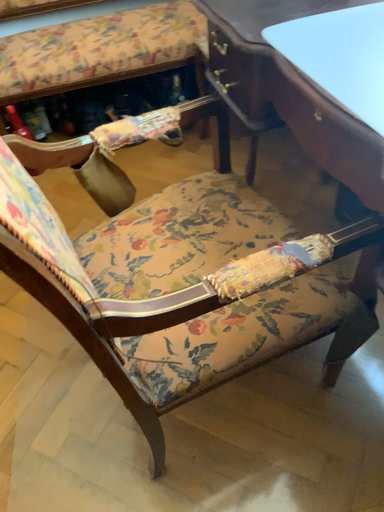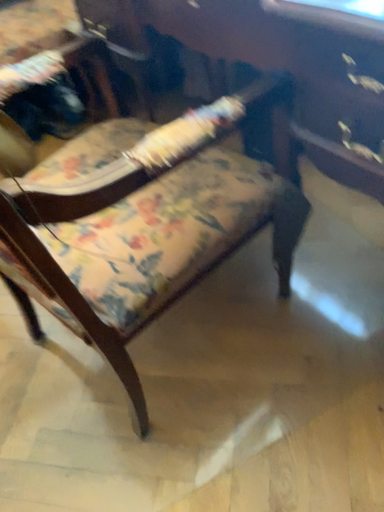
Question: How did the camera likely rotate when shooting the video?

Choices:
 (A) rotated right
 (B) rotated left

Answer: (A)